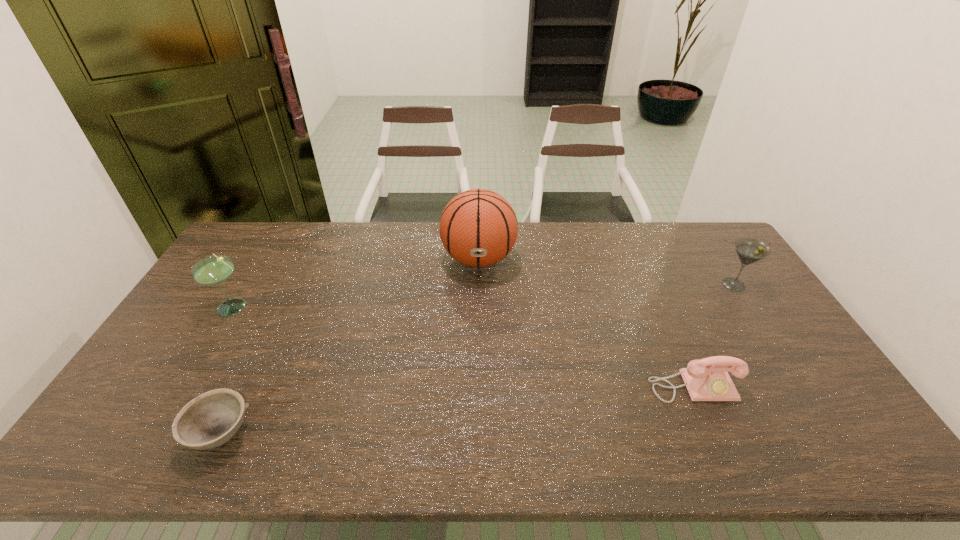
I want to click on blank space located 0.110m on the back of the left martini, so (255, 272).

Where is `vacant space positioned 0.130m on the dial of the fourth object from left to right`? vacant space positioned 0.130m on the dial of the fourth object from left to right is located at coordinates (721, 453).

Find the location of `vacant point located on the left of the bowl`. vacant point located on the left of the bowl is located at coordinates (102, 433).

Where is `object present at the far edge`? Image resolution: width=960 pixels, height=540 pixels. object present at the far edge is located at coordinates (478, 228).

You are a GUI agent. You are given a task and a screenshot of the screen. Output one action in this format:
    pyautogui.click(x=<x>, y=<y>)
    Task: Click on the object located at the near edge
    
    Given the screenshot: What is the action you would take?
    pyautogui.click(x=211, y=419)

You are a GUI agent. You are given a task and a screenshot of the screen. Output one action in this format:
    pyautogui.click(x=<x>, y=<y>)
    Task: Click on the object present at the left edge
    The width and height of the screenshot is (960, 540).
    Given the screenshot: What is the action you would take?
    [216, 269]

I want to click on object situated at the right edge, so click(x=749, y=250).

The image size is (960, 540). I want to click on free point at the far edge, so click(x=440, y=236).

Where is `vacant space at the near edge of the desktop`? vacant space at the near edge of the desktop is located at coordinates (413, 450).

In the image, there is a desktop. Find the location of `free space at the left edge`. free space at the left edge is located at coordinates (245, 279).